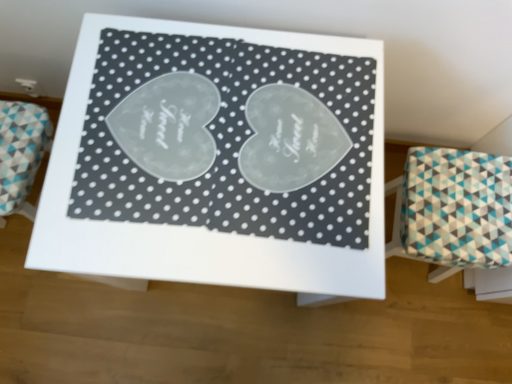
Question: Would you consider white glossy table at center to be distant from teal and white fabric stool at right?

Choices:
 (A) no
 (B) yes

Answer: (A)

Question: Is the depth of white glossy table at center less than that of teal and white fabric stool at right?

Choices:
 (A) yes
 (B) no

Answer: (A)

Question: Is white glossy table at center not within teal and white fabric stool at right?

Choices:
 (A) yes
 (B) no

Answer: (A)

Question: From a real-world perspective, is white glossy table at center physically above teal and white fabric stool at right?

Choices:
 (A) no
 (B) yes

Answer: (B)

Question: Can teal and white fabric stool at right be found inside white glossy table at center?

Choices:
 (A) no
 (B) yes

Answer: (A)

Question: From the image's perspective, is white glossy table at center above teal and white fabric stool at right?

Choices:
 (A) no
 (B) yes

Answer: (B)

Question: From a real-world perspective, does teal and white fabric stool at right sit lower than white glossy table at center?

Choices:
 (A) no
 (B) yes

Answer: (B)

Question: Could white glossy table at center be considered to be inside teal and white fabric stool at right?

Choices:
 (A) yes
 (B) no

Answer: (B)

Question: Can you confirm if teal and white fabric stool at right is thinner than white glossy table at center?

Choices:
 (A) no
 (B) yes

Answer: (B)

Question: Is teal and white fabric stool at right at the left side of white glossy table at center?

Choices:
 (A) no
 (B) yes

Answer: (A)

Question: Is teal and white fabric stool at right outside of white glossy table at center?

Choices:
 (A) no
 (B) yes

Answer: (B)

Question: Can you confirm if teal and white fabric stool at right is wider than white glossy table at center?

Choices:
 (A) no
 (B) yes

Answer: (A)

Question: Is white glossy table at center inside or outside of teal and white fabric stool at right?

Choices:
 (A) outside
 (B) inside

Answer: (A)